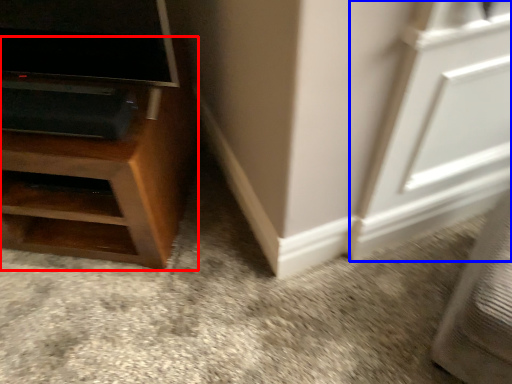
Question: Which point is further to the camera, furniture (highlighted by a red box) or screen door (highlighted by a blue box)?

Choices:
 (A) furniture
 (B) screen door

Answer: (A)